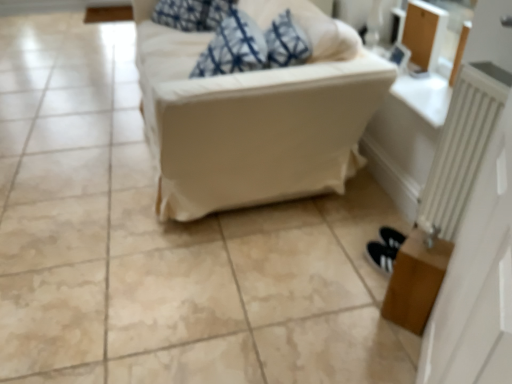
Locate an element on the screen. The image size is (512, 384). white fabric couch at center is located at coordinates (255, 115).

In order to click on brown wooden table at lower right in this screenshot , I will do `click(416, 281)`.

Between white fabric couch at center and brown wooden table at lower right, which one has larger size?

With larger size is white fabric couch at center.

From a real-world perspective, is white fabric couch at center located higher than brown wooden table at lower right?

Yes.

Based on the photo, considering the sizes of objects white fabric couch at center and brown wooden table at lower right in the image provided, who is wider, white fabric couch at center or brown wooden table at lower right?

white fabric couch at center.

How much distance is there between white fabric couch at center and brown wooden table at lower right?

white fabric couch at center is 29.22 inches away from brown wooden table at lower right.

Which of these two, white fabric couch at center or white metallic radiator at right, stands taller?

With more height is white fabric couch at center.

From the image's perspective, is white fabric couch at center positioned above or below white metallic radiator at right?

From the image's perspective, white fabric couch at center appears above white metallic radiator at right.

Does white fabric couch at center contain white metallic radiator at right?

No, white fabric couch at center does not contain white metallic radiator at right.

Which is in front, point (148, 75) or point (458, 74)?

Positioned in front is point (458, 74).

Is the position of white metallic radiator at right less distant than that of white fabric couch at center?

That is True.

Can you see white metallic radiator at right touching white fabric couch at center?

No, white metallic radiator at right is not next to white fabric couch at center.

Can you confirm if white metallic radiator at right is thinner than white fabric couch at center?

Yes.

Is white metallic radiator at right spatially inside white fabric couch at center, or outside of it?

white metallic radiator at right is not inside white fabric couch at center, it's outside.

Considering the relative sizes of brown wooden table at lower right and white metallic radiator at right in the image provided, is brown wooden table at lower right taller than white metallic radiator at right?

In fact, brown wooden table at lower right may be shorter than white metallic radiator at right.

Which object is thinner, brown wooden table at lower right or white metallic radiator at right?

Thinner between the two is white metallic radiator at right.

Identify the location of radiator lying on the right of brown wooden table at lower right. The width and height of the screenshot is (512, 384). (462, 145).

Which is closer, (439, 271) or (478, 64)?

The point (439, 271) is closer to the camera.

Which object is further away from the camera taking this photo, white metallic radiator at right or brown wooden table at lower right?

brown wooden table at lower right.

Considering the relative sizes of white metallic radiator at right and brown wooden table at lower right in the image provided, is white metallic radiator at right bigger than brown wooden table at lower right?

Yes, white metallic radiator at right is bigger than brown wooden table at lower right.

From a real-world perspective, does white metallic radiator at right stand above brown wooden table at lower right?

Yes, from a real-world perspective, white metallic radiator at right is on top of brown wooden table at lower right.

Looking at this image, between white metallic radiator at right and brown wooden table at lower right, which one has larger width?

brown wooden table at lower right is wider.

Between brown wooden table at lower right and white fabric couch at center, which one has larger width?

With larger width is white fabric couch at center.

In the image, is brown wooden table at lower right positioned in front of or behind white fabric couch at center?

Clearly, brown wooden table at lower right is in front of white fabric couch at center.

Considering the relative sizes of brown wooden table at lower right and white fabric couch at center in the image provided, is brown wooden table at lower right smaller than white fabric couch at center?

Indeed, brown wooden table at lower right has a smaller size compared to white fabric couch at center.

From a real-world perspective, is brown wooden table at lower right under white fabric couch at center?

Indeed, from a real-world perspective, brown wooden table at lower right is positioned beneath white fabric couch at center.

You are a GUI agent. You are given a task and a screenshot of the screen. Output one action in this format:
    pyautogui.click(x=<x>, y=<y>)
    Task: Click on the studio couch that is behind the brown wooden table at lower right
    This screenshot has width=512, height=384.
    Given the screenshot: What is the action you would take?
    pyautogui.click(x=255, y=115)

At what (x,y) coordinates should I click in order to perform the action: click on radiator below the white fabric couch at center (from a real-world perspective). Please return your answer as a coordinate pair (x, y). Looking at the image, I should click on (462, 145).

Consider the image. Looking at the image, which one is located closer to brown wooden table at lower right, white fabric couch at center or white metallic radiator at right?

white metallic radiator at right is positioned closer to the anchor brown wooden table at lower right.

Based on their spatial positions, is white metallic radiator at right or white fabric couch at center further from brown wooden table at lower right?

The object further to brown wooden table at lower right is white fabric couch at center.

From the image, which object appears to be nearer to white metallic radiator at right, brown wooden table at lower right or white fabric couch at center?

brown wooden table at lower right.

Based on their spatial positions, is brown wooden table at lower right or white metallic radiator at right further from white fabric couch at center?

Among the two, brown wooden table at lower right is located further to white fabric couch at center.

Which object lies further to the anchor point white fabric couch at center, white metallic radiator at right or brown wooden table at lower right?

Among the two, brown wooden table at lower right is located further to white fabric couch at center.

Looking at the image, which one is located closer to white metallic radiator at right, white fabric couch at center or brown wooden table at lower right?

Among the two, brown wooden table at lower right is located nearer to white metallic radiator at right.

The width and height of the screenshot is (512, 384). What are the coordinates of `radiator between white fabric couch at center and brown wooden table at lower right vertically` in the screenshot? It's located at (462, 145).